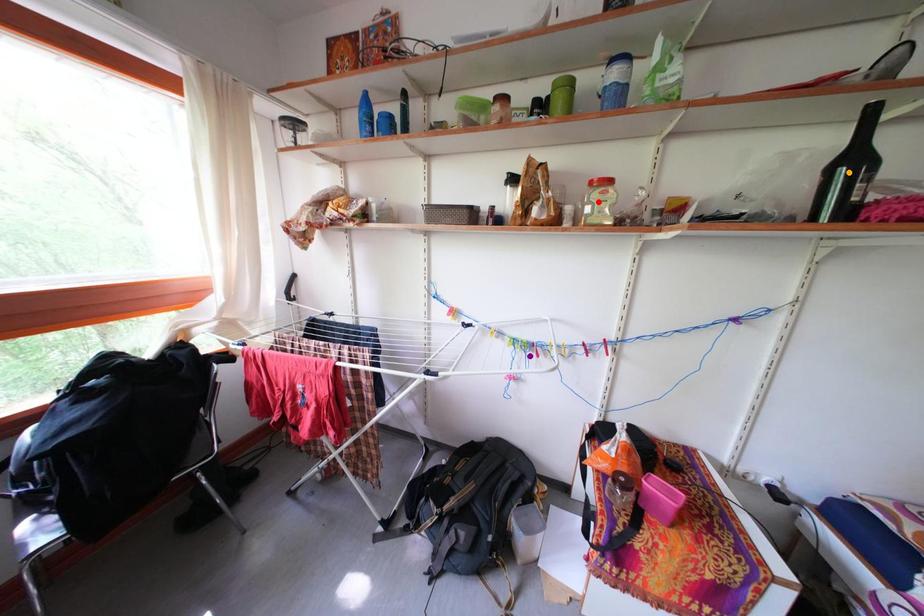
Consider the image. Order these from nearest to farthest:
red point, orange point, purple point

1. purple point
2. red point
3. orange point